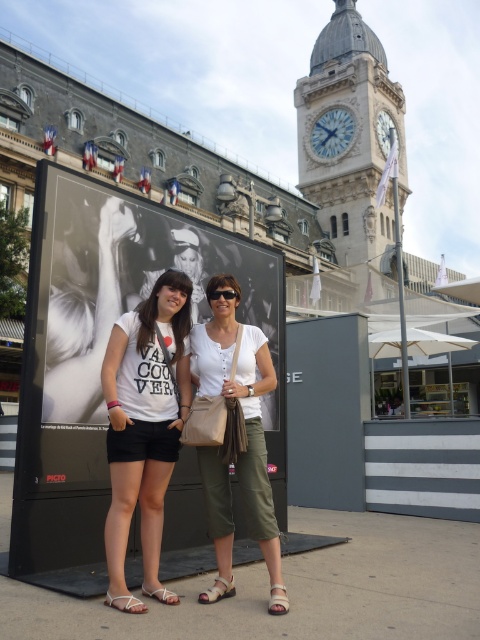
Question: Among these points, which one is nearest to the camera?

Choices:
 (A) (278, 268)
 (B) (364, 170)
 (C) (164, 314)
 (D) (269, 593)

Answer: (D)

Question: Can you confirm if black glossy poster at center is positioned above light brown leather sandal at lower center?

Choices:
 (A) yes
 (B) no

Answer: (A)

Question: Can you confirm if brown leather sandal at lower center is positioned to the left of white leather sandal at lower center?

Choices:
 (A) yes
 (B) no

Answer: (B)

Question: Which is nearer to the white cotton t-shirt at center?

Choices:
 (A) white cotton shirt at center
 (B) white leather sandal at lower center
 (C) transparent plastic goggles at center
 (D) white stone clock tower at upper center

Answer: (A)

Question: Which point is closer to the camera?

Choices:
 (A) (345, 42)
 (B) (217, 589)
 (C) (216, 298)

Answer: (B)

Question: In this image, where is black glossy poster at center located relative to white cotton t-shirt at center?

Choices:
 (A) below
 (B) above

Answer: (B)